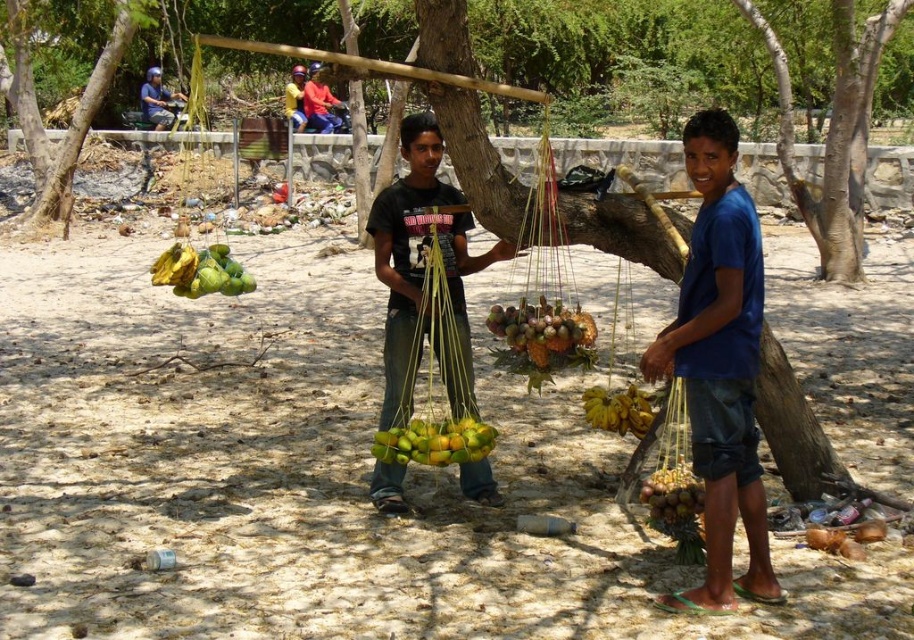
Question: Which point is farther to the camera?

Choices:
 (A) yellow matte bananas at center
 (B) green matte coconuts at center
 (C) brown rough coconuts at lower right
 (D) green leafy tree at upper left

Answer: (D)

Question: Is matte black shirt at center bigger than yellow matte oranges at center?

Choices:
 (A) no
 (B) yes

Answer: (B)

Question: Is matte black shirt at center above red shirt at upper center?

Choices:
 (A) no
 (B) yes

Answer: (A)

Question: Which point appears farthest from the camera in this image?

Choices:
 (A) (32, 99)
 (B) (454, 280)
 (C) (785, 172)

Answer: (A)

Question: Observing the image, what is the correct spatial positioning of brown rough coconuts at lower right in reference to red shirt at upper center?

Choices:
 (A) left
 (B) right

Answer: (B)

Question: Estimate the real-world distances between objects in this image. Which object is farther from the matte black shirt at center?

Choices:
 (A) green matte coconuts at center
 (B) yellow matte oranges at center
 (C) brown rough coconuts at lower right
 (D) green leafy tree at upper left

Answer: (D)